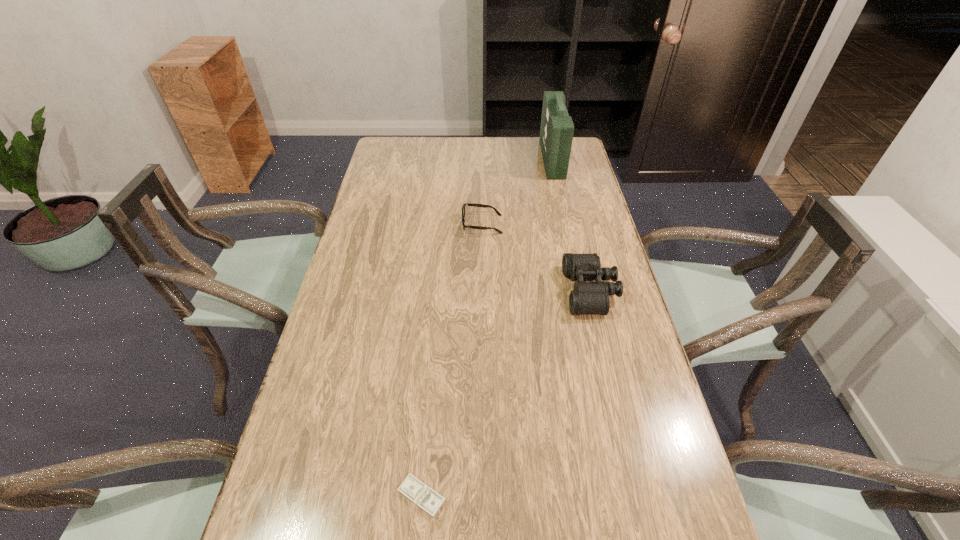
Locate an element on the screen. This screenshot has width=960, height=540. the farthest object is located at coordinates click(556, 132).

Find the location of a particular element. The height and width of the screenshot is (540, 960). the first-aid kit is located at coordinates (556, 132).

Find the location of `binoculars`. binoculars is located at coordinates (588, 298).

Find the location of a particular element. The image size is (960, 540). the second tallest object is located at coordinates (588, 298).

At what (x,y) coordinates should I click in order to perform the action: click on the second object from left to right. Please return your answer as a coordinate pair (x, y). The width and height of the screenshot is (960, 540). Looking at the image, I should click on (465, 204).

You are a GUI agent. You are given a task and a screenshot of the screen. Output one action in this format:
    pyautogui.click(x=<x>, y=<y>)
    Task: Click on the third tallest object
    The image size is (960, 540).
    Given the screenshot: What is the action you would take?
    pyautogui.click(x=465, y=204)

Find the location of a particular element. The width and height of the screenshot is (960, 540). money is located at coordinates (420, 494).

Locate an element on the screen. This screenshot has height=540, width=960. the leftmost object is located at coordinates (420, 494).

Find the location of a particular element. This screenshot has height=540, width=960. vacant space situated 0.330m on the front-facing side of the farthest object is located at coordinates (460, 159).

You are a GUI agent. You are given a task and a screenshot of the screen. Output one action in this format:
    pyautogui.click(x=<x>, y=<y>)
    Task: Click on the vacant area situated 0.230m on the front-facing side of the farthest object
    The height and width of the screenshot is (540, 960).
    Given the screenshot: What is the action you would take?
    pyautogui.click(x=485, y=159)